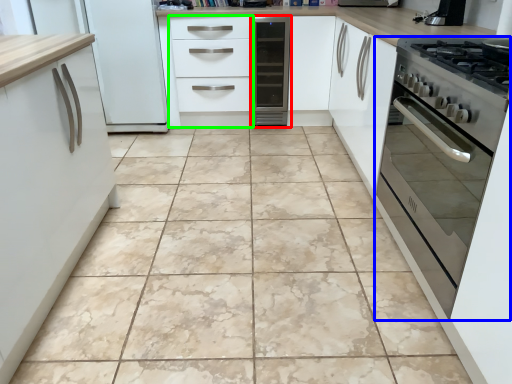
Question: Based on their relative distances, which object is nearer to home appliance (highlighted by a red box)? Choose from oven (highlighted by a blue box) and drawer (highlighted by a green box).

Choices:
 (A) oven
 (B) drawer

Answer: (B)